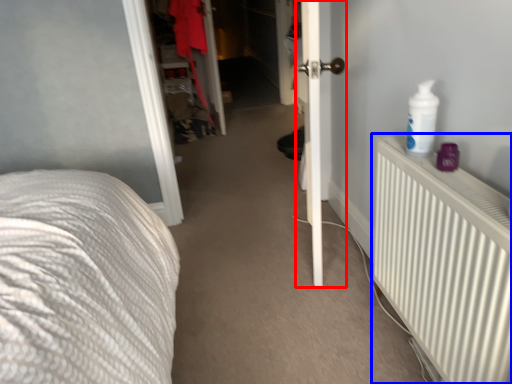
Question: Which object appears farthest to the camera in this image, door (highlighted by a red box) or radiator (highlighted by a blue box)?

Choices:
 (A) door
 (B) radiator

Answer: (A)